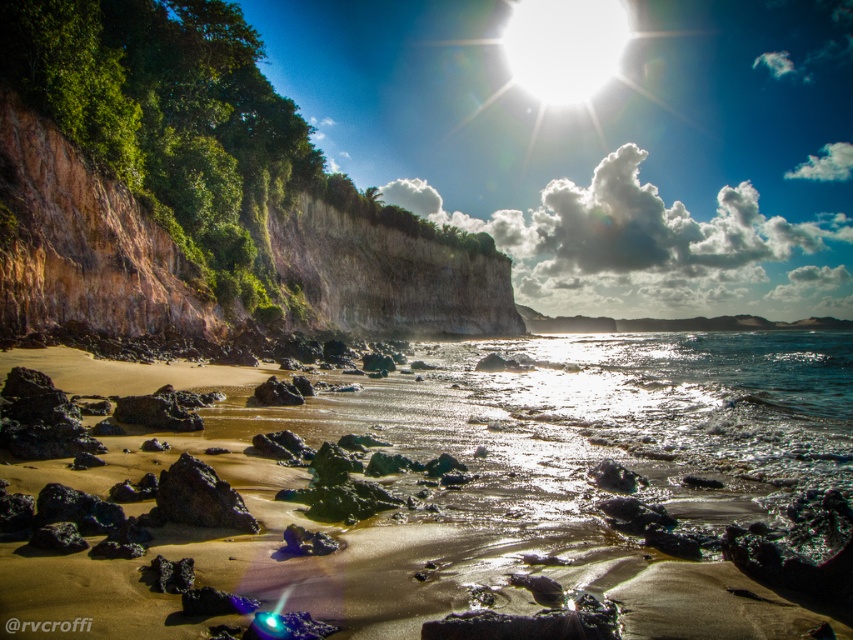
Which is more to the left, sandy beach at center or rustic stone cliff at left?

From the viewer's perspective, rustic stone cliff at left appears more on the left side.

Is sandy beach at center to the right of rustic stone cliff at left from the viewer's perspective?

Yes, sandy beach at center is to the right of rustic stone cliff at left.

You are a GUI agent. You are given a task and a screenshot of the screen. Output one action in this format:
    pyautogui.click(x=<x>, y=<y>)
    Task: Click on the sandy beach at center
    The height and width of the screenshot is (640, 853).
    Given the screenshot: What is the action you would take?
    pyautogui.click(x=390, y=529)

Is rustic stone cliff at left shorter than rough volcanic rock at center?

In fact, rustic stone cliff at left may be taller than rough volcanic rock at center.

Who is more forward, (64, 240) or (194, 500)?

Point (194, 500)

The image size is (853, 640). What are the coordinates of `rustic stone cliff at left` in the screenshot? It's located at (84, 243).

Find the location of a particular element. sandy beach at center is located at coordinates (390, 529).

Between point (656, 490) and point (228, 499), which one is positioned in front?

Point (228, 499)

Is point (788, 353) positioned in front of point (184, 518)?

No, (788, 353) is behind (184, 518).

The height and width of the screenshot is (640, 853). What are the coordinates of `sandy beach at center` in the screenshot? It's located at (390, 529).